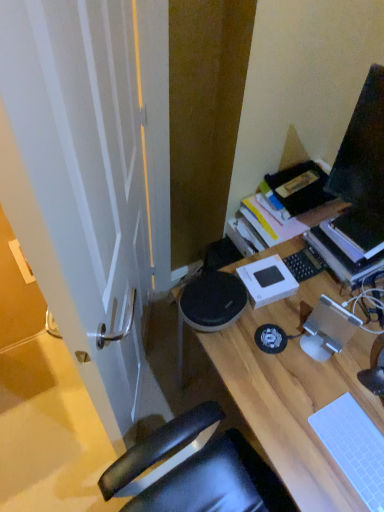
Where is `empty space that is ontop of wooden desk at center`? The image size is (384, 512). empty space that is ontop of wooden desk at center is located at coordinates (328, 382).